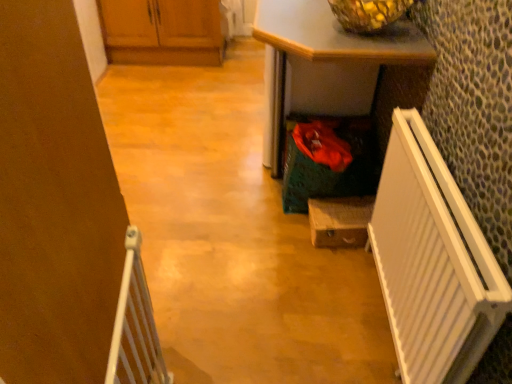
The width and height of the screenshot is (512, 384). In order to click on free space to the left of green textured desk at center in this screenshot , I will do point(186,136).